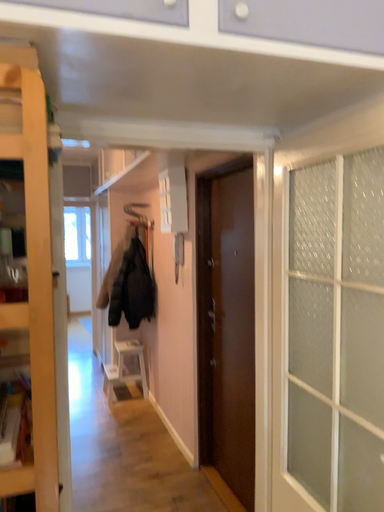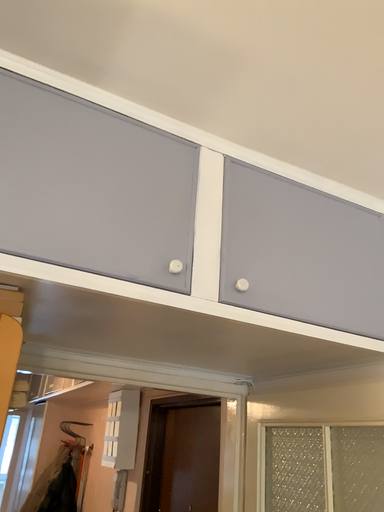
Question: How did the camera likely rotate when shooting the video?

Choices:
 (A) rotated left
 (B) rotated right

Answer: (B)